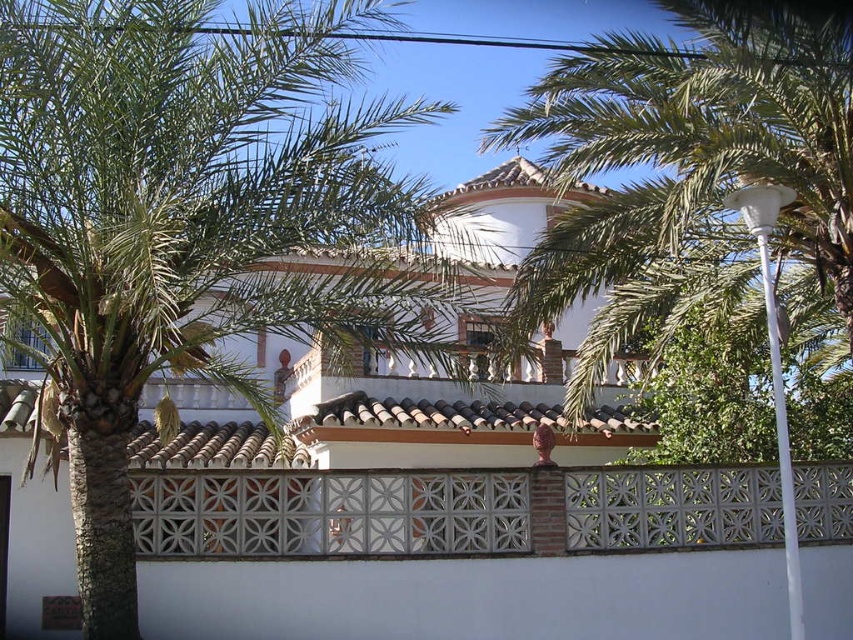
Question: Is green leafy palm tree at left smaller than white textured tile fence at center?

Choices:
 (A) no
 (B) yes

Answer: (A)

Question: Which object is closer to the camera taking this photo?

Choices:
 (A) white textured tile fence at center
 (B) green leafy palm tree at left

Answer: (B)

Question: Which point appears closest to the camera in this image?

Choices:
 (A) click(x=84, y=54)
 (B) click(x=569, y=520)

Answer: (A)

Question: Is green leafy palm tree at left to the left of white textured tile fence at center from the viewer's perspective?

Choices:
 (A) no
 (B) yes

Answer: (B)

Question: Is green leafy palm tree at left further to the viewer compared to white textured tile fence at center?

Choices:
 (A) yes
 (B) no

Answer: (B)